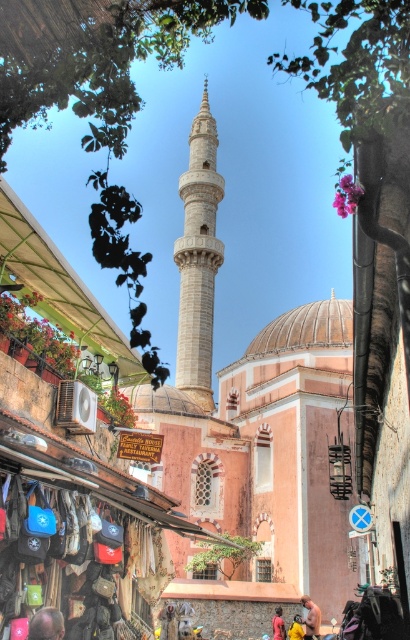
You are standing on the street and see the white stone minaret at center and the dark blue shirt at lower center. Which object is located to the right of the other?

The dark blue shirt at lower center is located to the right of the white stone minaret at center.

You are a tourist standing in front of the mosque and notice the white stone minaret at center and the yellow fabric bag at center. Which object is located to the right of the other?

The white stone minaret at center is positioned on the left side of yellow fabric bag at center, so the yellow fabric bag at center is to the right of the white stone minaret at center.